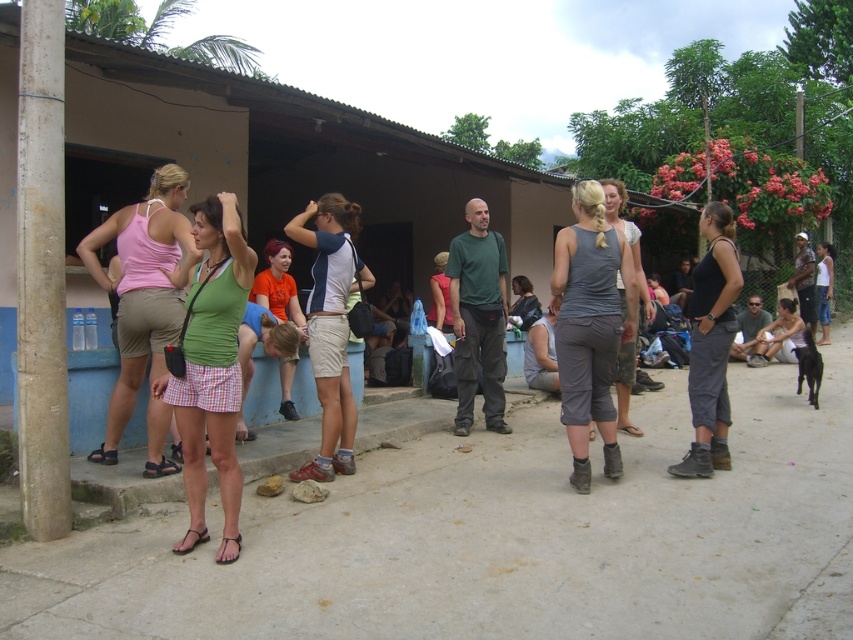
Consider the image. You are a photographer trying to capture the matte blue and white shirt at center and the black fabric tank top at center in the same frame. Which clothing item is positioned higher in the image?

The matte blue and white shirt at center is located above the black fabric tank top at center, so it is positioned higher in the image.

You are a tailor who needs to determine which shirt requires more fabric for a similar design. Based on the image, which shirt between the green fabric shirt at center and the light pink fabric shirt at center would need more fabric?

The light pink fabric shirt at center requires more fabric because its width is greater than the green fabric shirt at center.